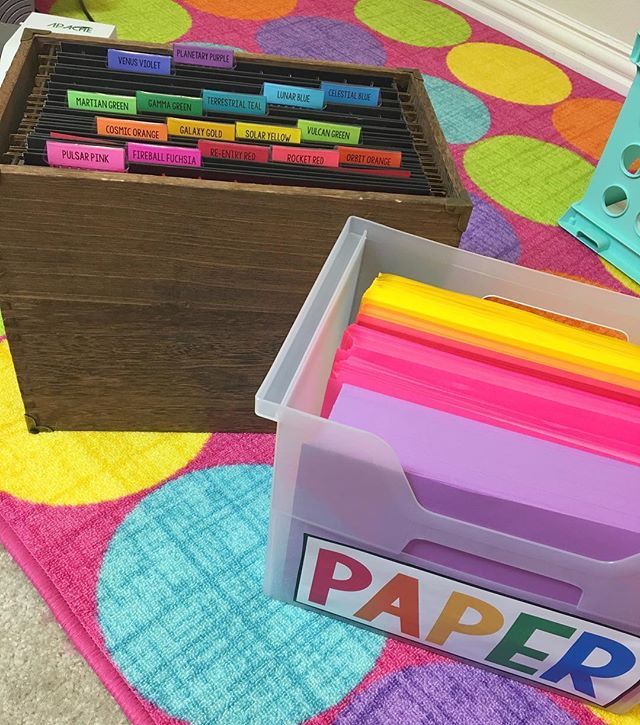
Locate an element on the screen. The image size is (640, 725). brown carpet is located at coordinates coord(65,665).